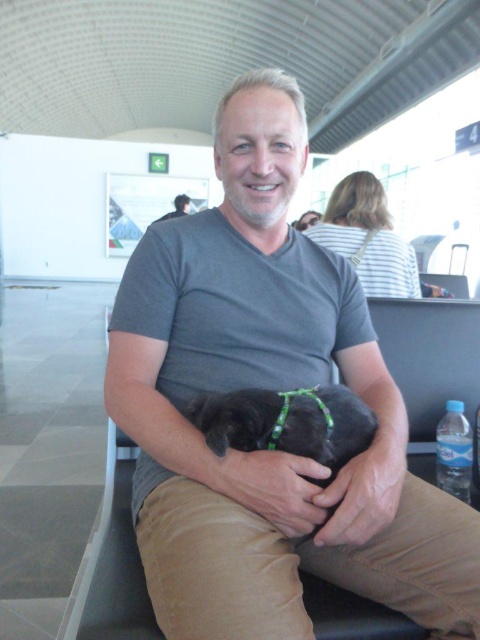
Question: Which point is closer to the camera?

Choices:
 (A) black matte dog at center
 (B) gray cotton shirt at center
 (C) matte gray shirt at center

Answer: (B)

Question: Where is black matte dog at center located in relation to matte gray shirt at center in the image?

Choices:
 (A) left
 (B) right

Answer: (B)

Question: Which point is closer to the camera?

Choices:
 (A) click(167, 212)
 (B) click(241, 240)

Answer: (B)

Question: Which point is closer to the camera taking this photo?

Choices:
 (A) (155, 221)
 (B) (400, 592)

Answer: (B)

Question: Does gray cotton shirt at center appear on the left side of matte gray shirt at center?

Choices:
 (A) no
 (B) yes

Answer: (A)

Question: Can you confirm if gray cotton shirt at center is positioned below black matte dog at center?

Choices:
 (A) yes
 (B) no

Answer: (B)